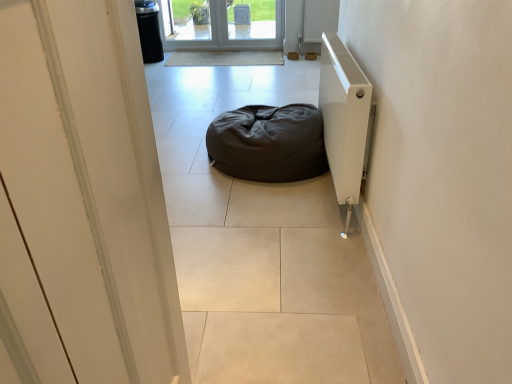
Image resolution: width=512 pixels, height=384 pixels. Find the location of `free location in front of dark fabric bean bag at center`. free location in front of dark fabric bean bag at center is located at coordinates (250, 214).